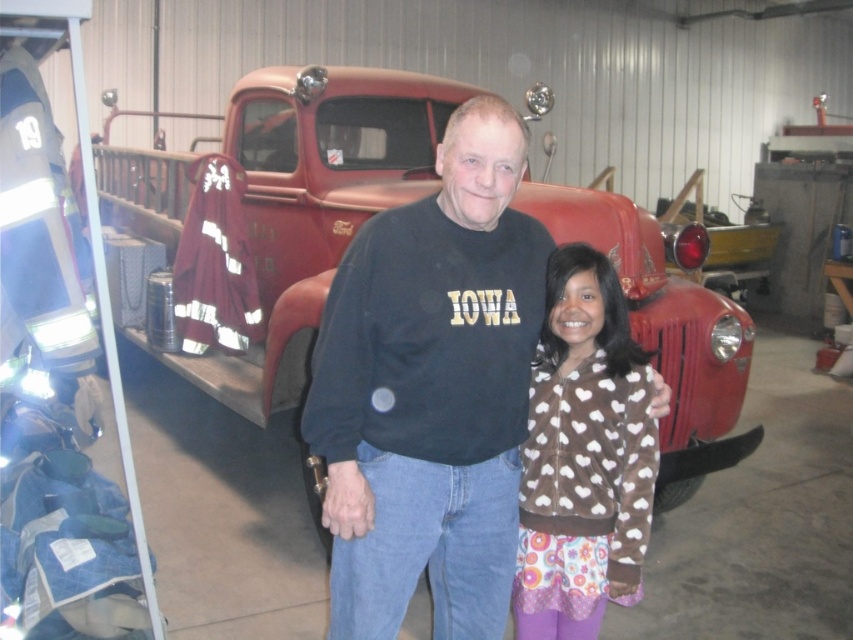
Does black cotton sweatshirt at center appear on the right side of metallic red truck at center?

Yes, black cotton sweatshirt at center is to the right of metallic red truck at center.

Is black cotton sweatshirt at center to the left of metallic red truck at center from the viewer's perspective?

Incorrect, black cotton sweatshirt at center is not on the left side of metallic red truck at center.

Measure the distance between black cotton sweatshirt at center and camera.

black cotton sweatshirt at center and camera are 6.05 feet apart from each other.

Locate an element on the screen. Image resolution: width=853 pixels, height=640 pixels. black cotton sweatshirt at center is located at coordinates (430, 390).

Looking at this image, is black cotton sweatshirt at center below brown fleece jacket at center?

Actually, black cotton sweatshirt at center is above brown fleece jacket at center.

Does black cotton sweatshirt at center have a greater width compared to brown fleece jacket at center?

Yes.

Between point (457, 336) and point (544, 406), which one is positioned in front?

Positioned in front is point (457, 336).

Where is `black cotton sweatshirt at center`? black cotton sweatshirt at center is located at coordinates (430, 390).

Does point (277, 118) come closer to viewer compared to point (550, 481)?

No, (277, 118) is further to viewer.

Can you confirm if metallic red truck at center is positioned above brown fleece jacket at center?

Yes.

Where is `metallic red truck at center`? metallic red truck at center is located at coordinates (315, 202).